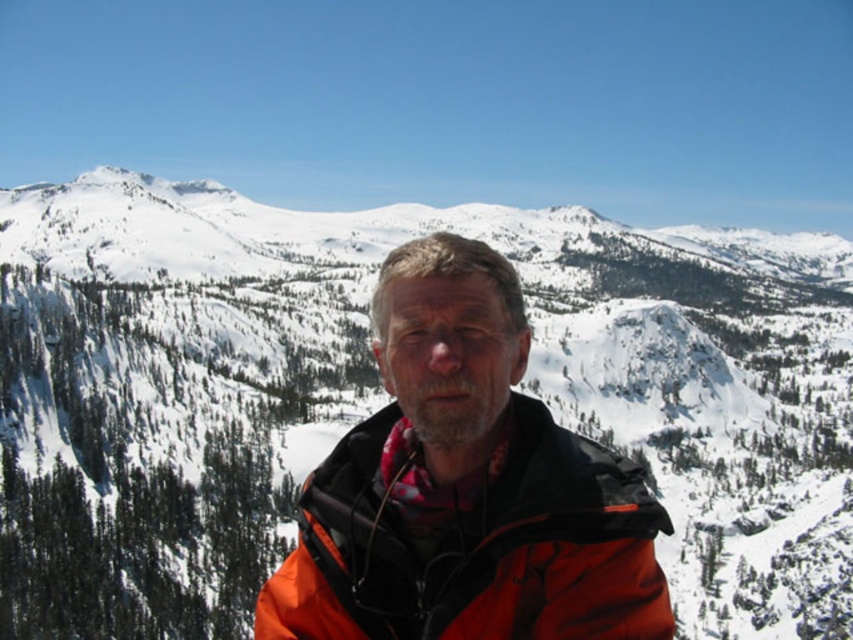
You are a photographer planning to take a portrait of the person wearing the orange softshell jacket at center and the snowy mountain at center. Which object should you focus on first to ensure both are in the frame?

The orange softshell jacket at center is behind the snowy mountain at center, so you should focus on the snowy mountain at center first to ensure both are in the frame.